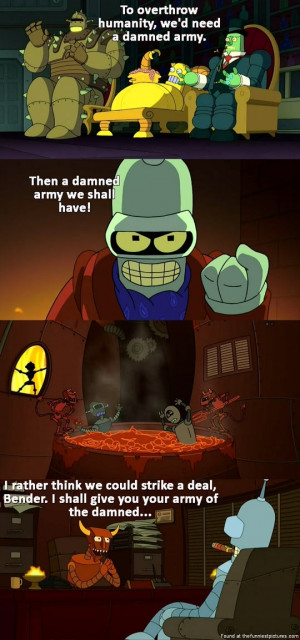
The image size is (300, 640). Identify the location of chair. (242, 612).